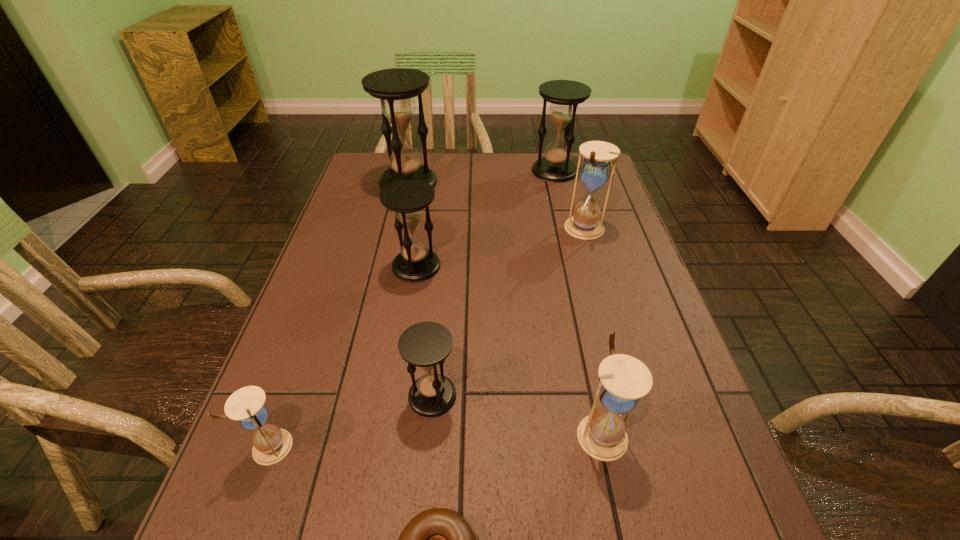
Locate an element on the screen. the nearest black hourglass is located at coordinates (426, 344).

The image size is (960, 540). I want to click on vacant position located on the right of the tallest object, so click(530, 183).

Where is `free space located 0.270m on the front of the second biggest black hourglass`? The height and width of the screenshot is (540, 960). free space located 0.270m on the front of the second biggest black hourglass is located at coordinates (570, 234).

Identify the location of blank space located on the front of the third farthest object. This screenshot has width=960, height=540. (603, 293).

The width and height of the screenshot is (960, 540). What are the coordinates of `blank space located on the front of the third biggest black hourglass` in the screenshot? It's located at (397, 384).

Identify the location of vacant region located 0.280m on the left of the second smallest white hourglass. The height and width of the screenshot is (540, 960). (421, 432).

At what (x,y) coordinates should I click in order to perform the action: click on free space located on the front of the leftmost hourglass. Please return your answer as a coordinate pair (x, y). Looking at the image, I should click on (244, 523).

Find the location of `free space located 0.230m on the left of the nearest black hourglass`. free space located 0.230m on the left of the nearest black hourglass is located at coordinates (289, 396).

You are a GUI agent. You are given a task and a screenshot of the screen. Output one action in this format:
    pyautogui.click(x=<x>, y=<y>)
    Task: Click on the object at the far left corner
    Image resolution: width=960 pixels, height=540 pixels.
    Given the screenshot: What is the action you would take?
    pyautogui.click(x=396, y=87)

Identify the location of object located in the far right corner section of the desktop. This screenshot has width=960, height=540. (564, 95).